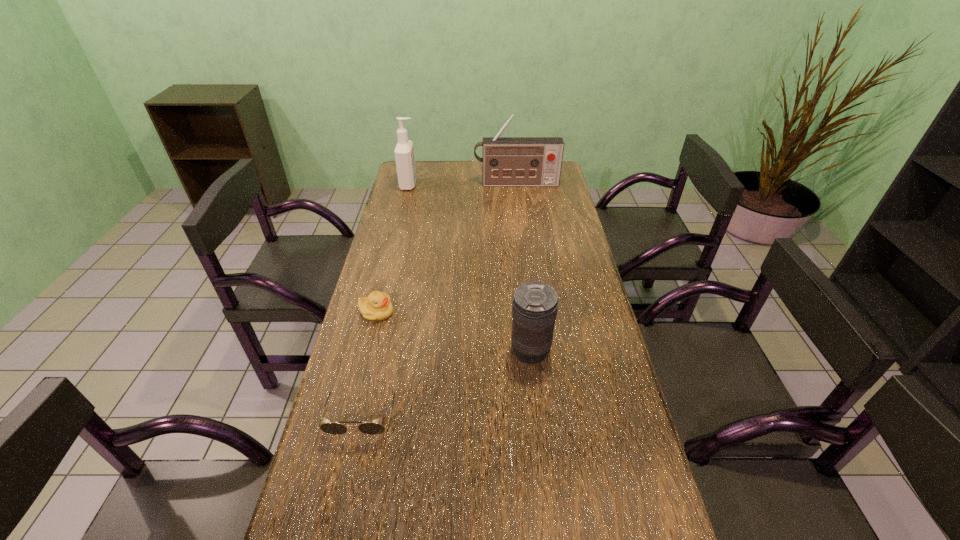
You are a GUI agent. You are given a task and a screenshot of the screen. Output one action in this format:
    pyautogui.click(x=<x>, y=<y>)
    Task: Click on the free spot between the third shortest object and the cleansing agent
    
    Given the screenshot: What is the action you would take?
    pyautogui.click(x=469, y=268)

Where is `unoccupied area between the second nearest object and the cleansing agent`? unoccupied area between the second nearest object and the cleansing agent is located at coordinates (469, 268).

This screenshot has height=540, width=960. In order to click on empty space between the radio receiver and the cleansing agent in this screenshot , I will do `click(463, 184)`.

The width and height of the screenshot is (960, 540). In order to click on the fourth closest object to the radio receiver in this screenshot , I will do `click(332, 428)`.

Find the location of a particular element. Image resolution: width=960 pixels, height=540 pixels. object that is the fourth closest to the cleansing agent is located at coordinates (332, 428).

In order to click on vacant space that satisfies the following two spatial constraints: 1. on the front panel of the radio receiver; 2. on the front label of the cleansing agent in this screenshot , I will do `click(516, 185)`.

At what (x,y) coordinates should I click in order to perform the action: click on vacant region that satisfies the following two spatial constraints: 1. on the side of the second nearest object where the control switches are located; 2. on the front lenses of the nearest object. Please return your answer as a coordinate pair (x, y). Image resolution: width=960 pixels, height=540 pixels. Looking at the image, I should click on (537, 414).

At what (x,y) coordinates should I click in order to perform the action: click on vacant space that satisfies the following two spatial constraints: 1. on the side of the telephoto lens where the control switches are located; 2. on the front lenses of the sunglasses. Please return your answer as a coordinate pair (x, y). This screenshot has height=540, width=960. Looking at the image, I should click on (537, 414).